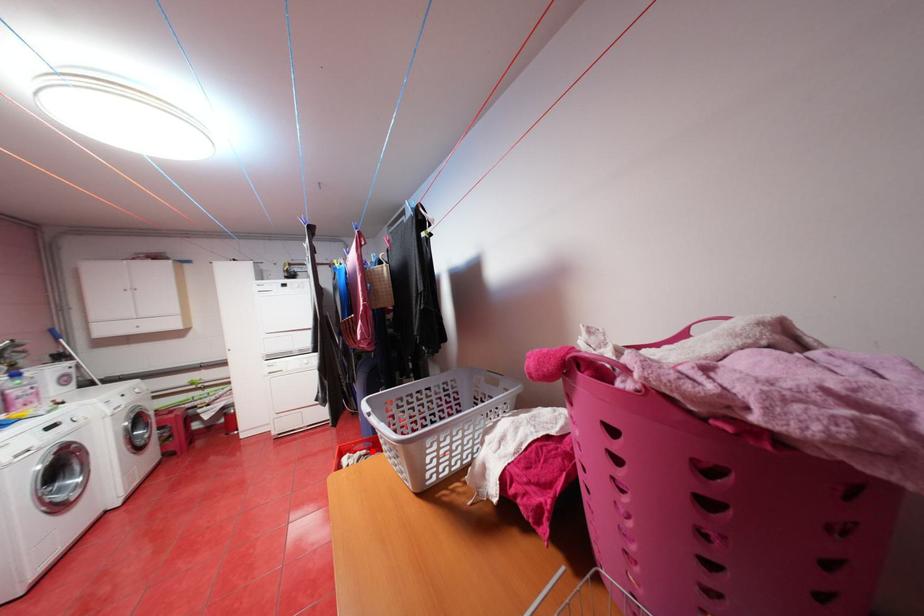
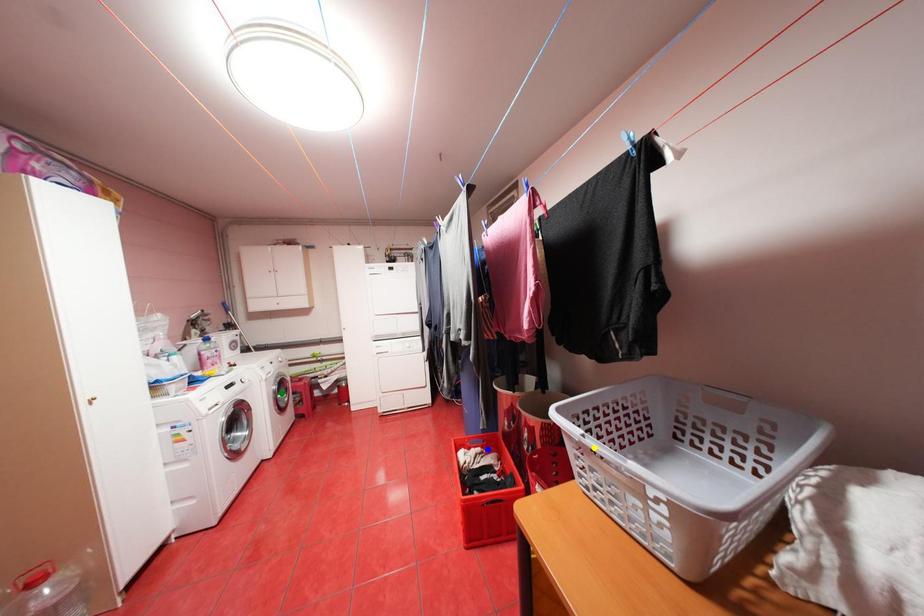
Question: I am providing you with two images of the same scene from different viewpoints. A red point is marked on the first image. You are given multiple points on the second image. Which point in image 2 represents the same 3d spot as the red point in image 1?

Choices:
 (A) blue point
 (B) green point
 (C) yellow point

Answer: (A)